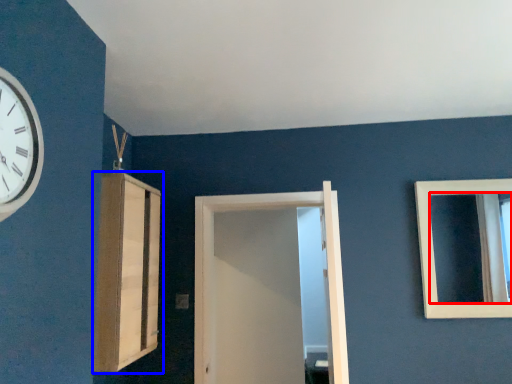
Question: Which object is further to the camera taking this photo, mirror (highlighted by a red box) or cabinetry (highlighted by a blue box)?

Choices:
 (A) mirror
 (B) cabinetry

Answer: (A)